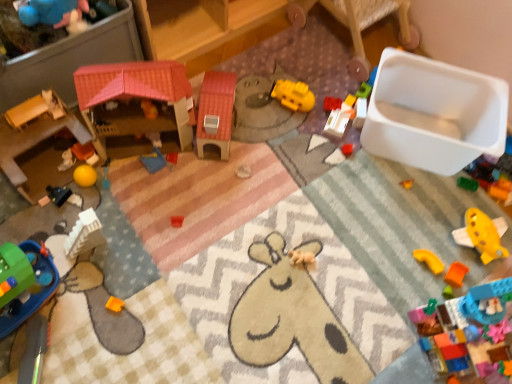
In order to click on vacant space behind yellow matte plastic toy at center, which is the 8th toy from left to right in this screenshot , I will do `click(296, 66)`.